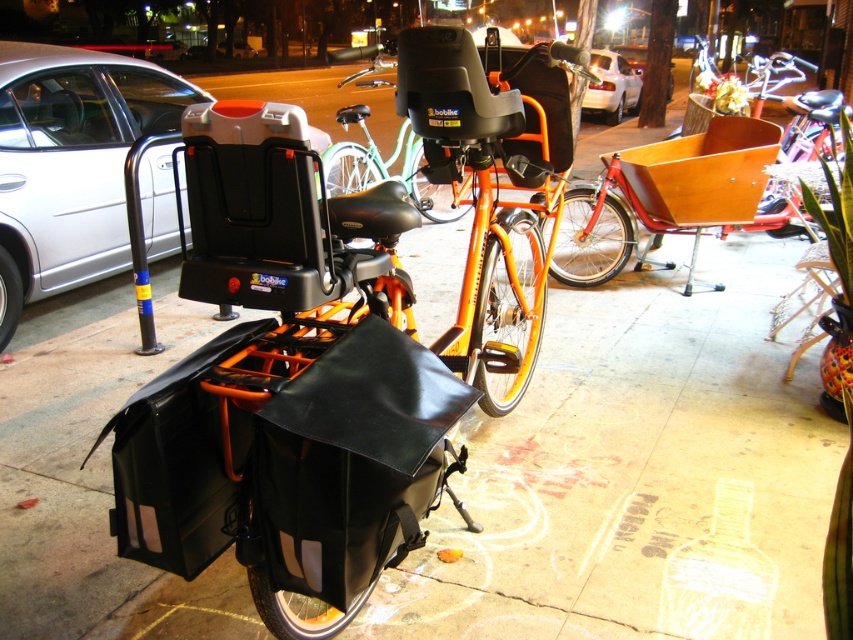
Question: Which of these objects is positioned farthest from the matte black bike rack at left?

Choices:
 (A) white glossy car at upper center
 (B) orange matte bicycle at center

Answer: (A)

Question: Is matte black bike rack at left below wooden cart at center?

Choices:
 (A) yes
 (B) no

Answer: (B)

Question: Which of the following is the farthest from the observer?

Choices:
 (A) wooden cart at center
 (B) orange matte bicycle at center
 (C) matte black bike rack at left
 (D) white glossy car at upper center

Answer: (D)

Question: Can you confirm if matte black bike rack at left is positioned below wooden cart at center?

Choices:
 (A) yes
 (B) no

Answer: (B)

Question: Is matte black bike rack at left smaller than wooden cart at center?

Choices:
 (A) no
 (B) yes

Answer: (A)

Question: Which point is farther to the camera?

Choices:
 (A) (454, 218)
 (B) (750, 161)
 (C) (51, 122)

Answer: (A)